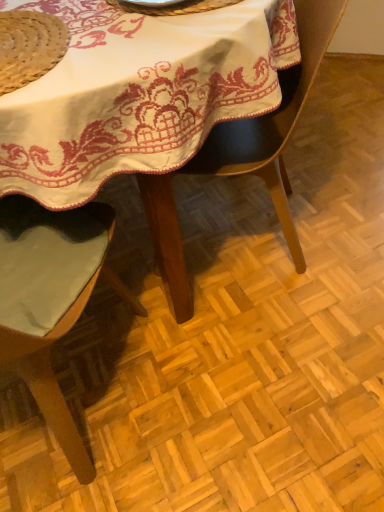
Question: From a real-world perspective, is metallic silver plate at upper center above or below natural straw hat at upper left?

Choices:
 (A) above
 (B) below

Answer: (A)

Question: Do you think metallic silver plate at upper center is within natural straw hat at upper left, or outside of it?

Choices:
 (A) outside
 (B) inside

Answer: (A)

Question: Which of these objects is positioned farthest from the green fabric chair at left, which is the second chair in right-to-left order?

Choices:
 (A) natural straw hat at upper left
 (B) black leather chair at center, the second chair in the left-to-right sequence
 (C) white embroidered tablecloth at center
 (D) metallic silver plate at upper center

Answer: (D)

Question: Estimate the real-world distances between objects in this image. Which object is farther from the white embroidered tablecloth at center?

Choices:
 (A) metallic silver plate at upper center
 (B) natural straw hat at upper left
 (C) black leather chair at center, the first chair viewed from the right
 (D) green fabric chair at left, which appears as the 1th chair when viewed from the left

Answer: (D)